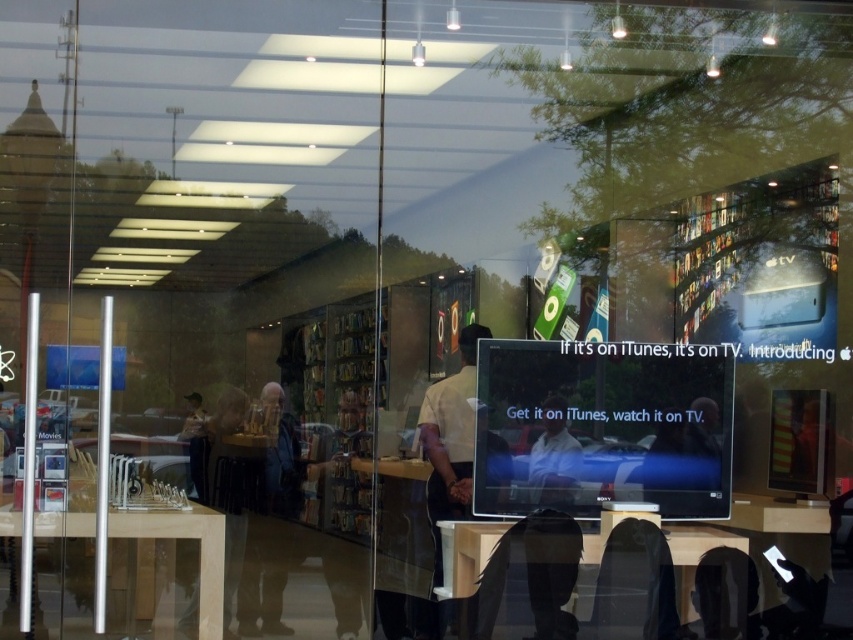
From the picture: You are a customer in an Apple Store and want to place your bag on the nearest table. Which table should you choose between the matte black table at lower center and the light brown wooden table at left?

The matte black table at lower center has a smaller size compared to the light brown wooden table at left, so the light brown wooden table at left is larger and more suitable for placing your bag.

You are a customer in the Apple Store and want to compare products on both the matte black table at lower center and the light brown wooden table at left. Which table should you approach first to start from the left side of the store?

You should start with the light brown wooden table at left because the matte black table at lower center is to the right of it.

You are a customer in the Apple Store and want to check out the products on both the matte black table at lower center and the light brown wooden table at left. Which table should you approach first if you want to start from the higher position?

You should approach the light brown wooden table at left first because the matte black table at lower center is located below it, meaning the light brown wooden table at left is positioned higher up.